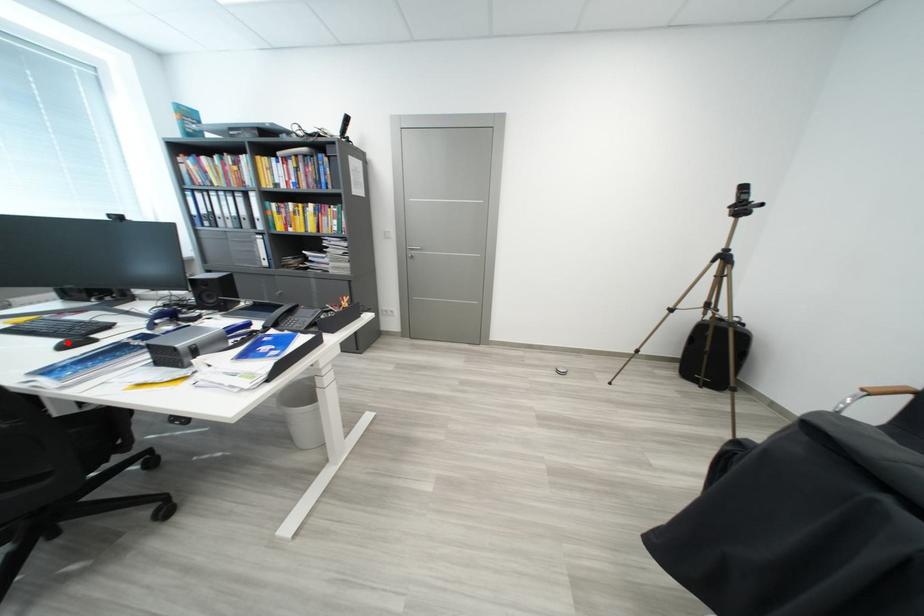
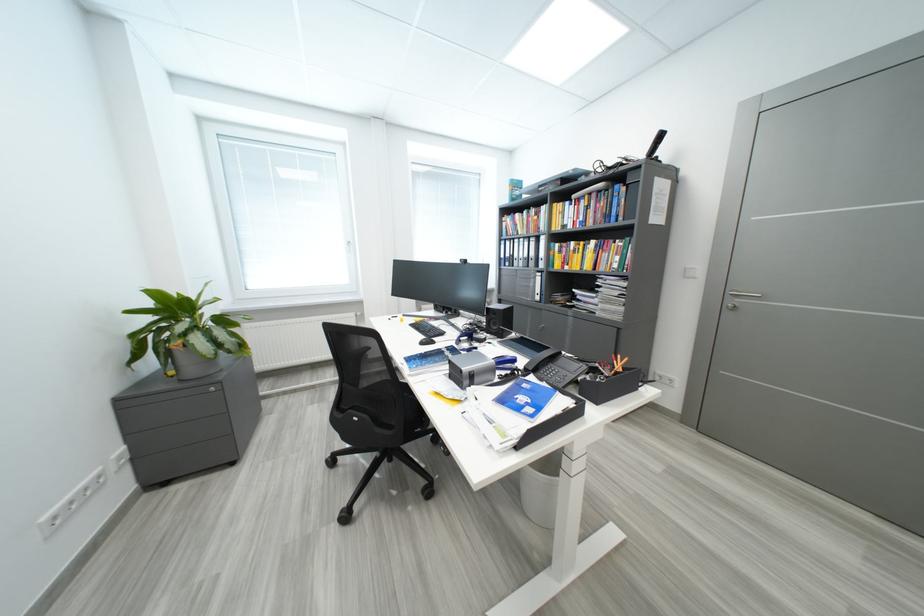
Question: I am providing you with two images of the same scene from different viewpoints. A red point is shown in image1. For the corresponding object point in image2, is it positioned nearer or farther from the camera?

Choices:
 (A) Nearer
 (B) Farther

Answer: (A)